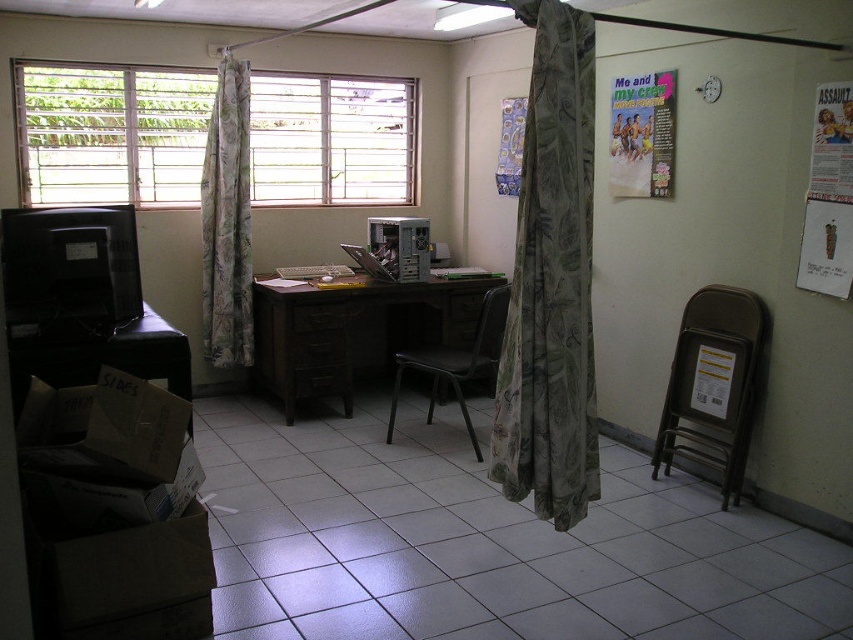
Question: Is floral fabric curtain at left further to the viewer compared to matte plastic poster at upper right?

Choices:
 (A) no
 (B) yes

Answer: (B)

Question: Estimate the real-world distances between objects in this image. Which object is closer to the brown wood drawer at center?

Choices:
 (A) paperboard poster at upper right
 (B) dark wood computer desk at center

Answer: (B)

Question: Which object appears closest to the camera in this image?

Choices:
 (A) brown cardboard box at lower left
 (B) dark wood computer desk at center

Answer: (A)

Question: Does camouflage fabric curtain at center have a greater width compared to black wood drawer at center?

Choices:
 (A) no
 (B) yes

Answer: (A)

Question: From the image, what is the correct spatial relationship of black metal chair at center in relation to brown wood drawer at center?

Choices:
 (A) below
 (B) above

Answer: (A)

Question: Which is nearer to the white textured window at upper center?

Choices:
 (A) camouflage fabric curtain at center
 (B) black metal chair at center
 (C) wooden drawer at center

Answer: (C)